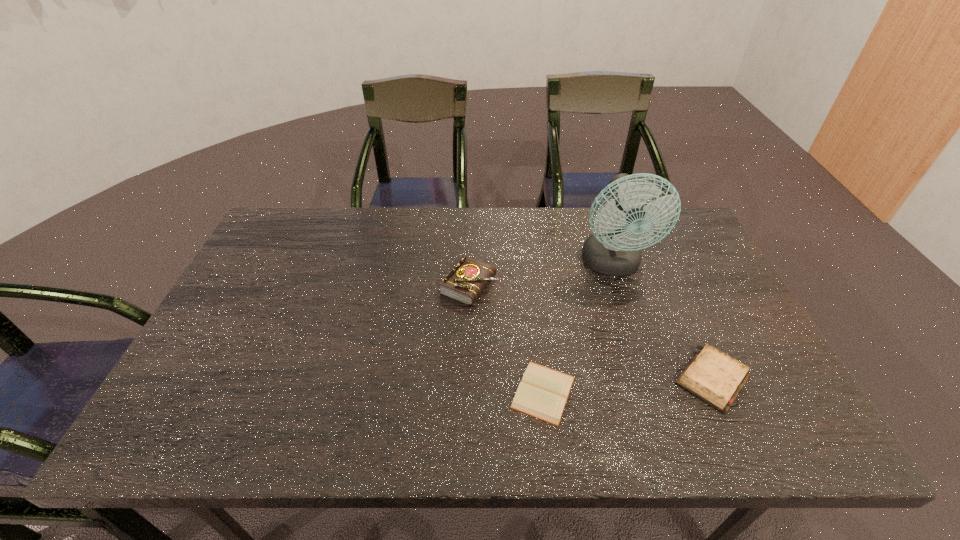
Find the location of a particular element. free space between the leftmost diary and the fan is located at coordinates (541, 275).

This screenshot has width=960, height=540. Identify the location of vacant space that's between the shortest diary and the fan. pyautogui.click(x=578, y=328).

At what (x,y) coordinates should I click in order to perform the action: click on free area in between the second shortest object and the leftmost diary. Please return your answer as a coordinate pair (x, y). Looking at the image, I should click on (591, 332).

Locate an element on the screen. free spot between the third tallest object and the second diary from left to right is located at coordinates (628, 386).

Identify the location of empty space that is in between the tallest object and the leftmost object. The height and width of the screenshot is (540, 960). (541, 275).

The height and width of the screenshot is (540, 960). Identify the location of free spot between the tallest object and the rightmost diary. coord(662,322).

The width and height of the screenshot is (960, 540). I want to click on blank region between the second diary from left to right and the tallest object, so click(x=578, y=328).

Image resolution: width=960 pixels, height=540 pixels. What are the coordinates of `unoccupied area between the fan and the third object from right to left` in the screenshot? It's located at (578, 328).

Locate an element on the screen. This screenshot has width=960, height=540. vacant area that lies between the tallest object and the second shortest diary is located at coordinates (662, 322).

Image resolution: width=960 pixels, height=540 pixels. I want to click on vacant point located between the third object from right to left and the fan, so click(578, 328).